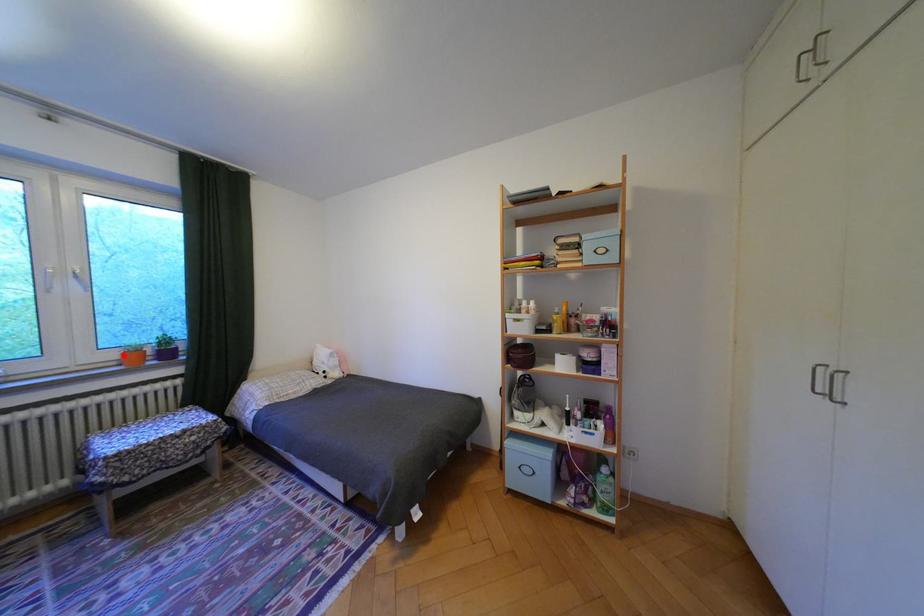
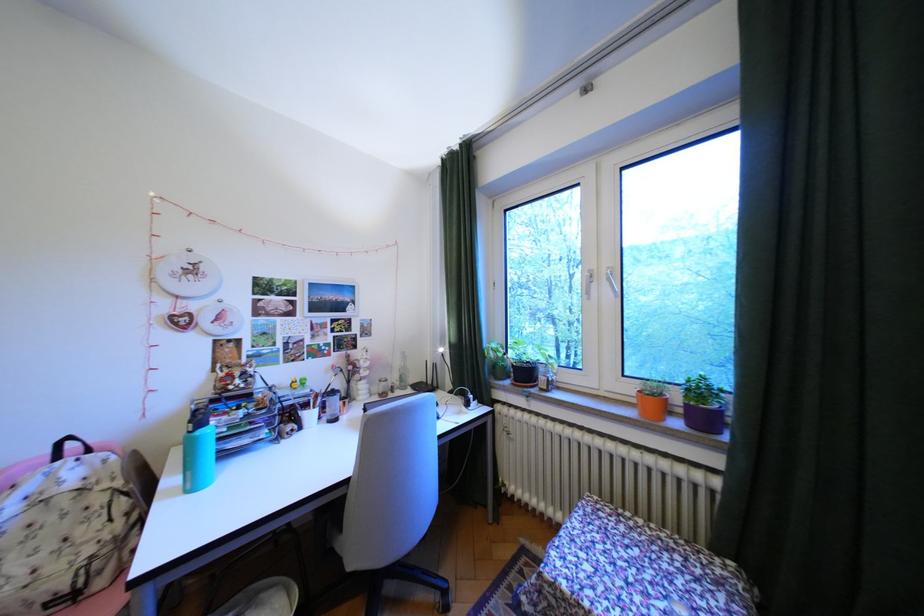
Where in the second image is the point corresponding to the highlighted location from the first image?

(641, 390)